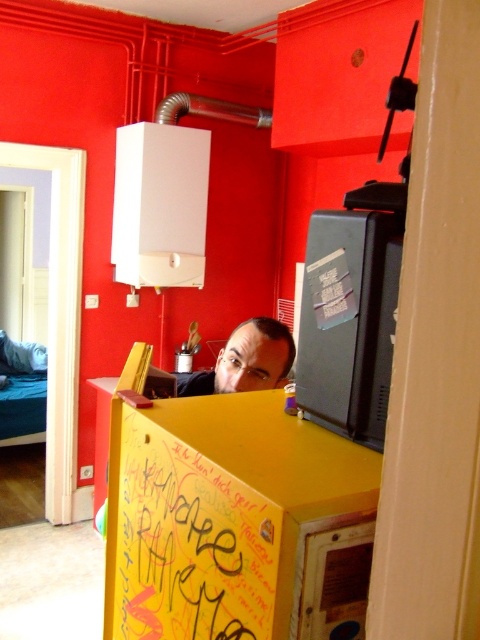
Between yellow cardboard box at lower center and yellow paperboard sign at center, which one is positioned higher?

yellow cardboard box at lower center is higher up.

How far apart are yellow cardboard box at lower center and yellow paperboard sign at center?

They are 1.41 inches apart.

What do you see at coordinates (236, 522) in the screenshot? I see `yellow cardboard box at lower center` at bounding box center [236, 522].

This screenshot has height=640, width=480. What are the coordinates of `yellow cardboard box at lower center` in the screenshot? It's located at (236, 522).

Does yellow paperboard sign at center appear on the left side of matte black monitor at upper right?

Indeed, yellow paperboard sign at center is positioned on the left side of matte black monitor at upper right.

Between yellow paperboard sign at center and matte black monitor at upper right, which one appears on the right side from the viewer's perspective?

matte black monitor at upper right is more to the right.

Is point (144, 480) positioned before point (335, 330)?

No, it is not.

I want to click on yellow paperboard sign at center, so click(x=191, y=547).

Does yellow cardboard box at lower center have a larger size compared to matte black monitor at upper right?

Yes, yellow cardboard box at lower center is bigger than matte black monitor at upper right.

Does yellow cardboard box at lower center have a lesser height compared to matte black monitor at upper right?

No, yellow cardboard box at lower center is not shorter than matte black monitor at upper right.

Which is in front, point (336, 628) or point (347, 214)?

Positioned in front is point (336, 628).

The height and width of the screenshot is (640, 480). In order to click on yellow cardboard box at lower center in this screenshot , I will do `click(236, 522)`.